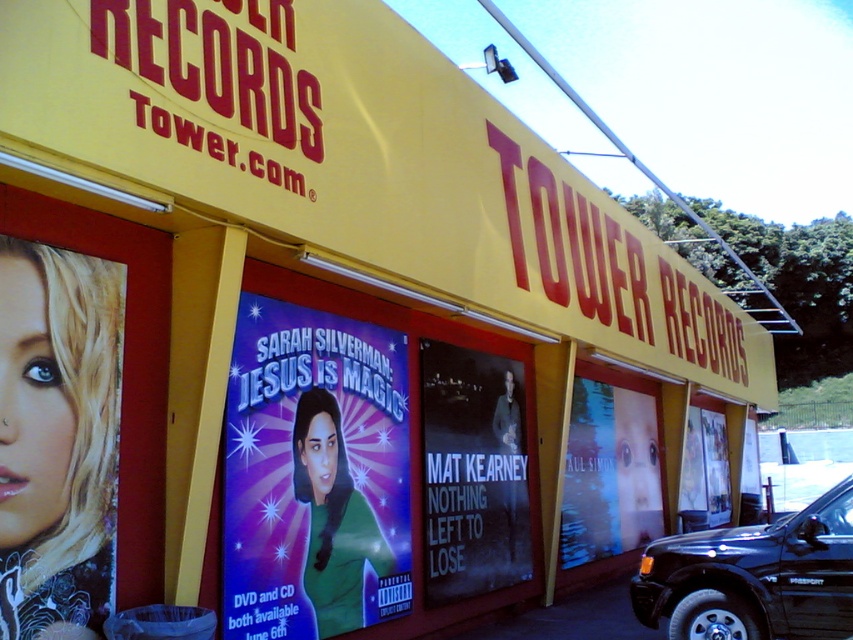
This screenshot has height=640, width=853. What do you see at coordinates (312, 474) in the screenshot? I see `purple glossy poster at center` at bounding box center [312, 474].

Does purple glossy poster at center have a smaller size compared to black matte poster at center?

Yes, purple glossy poster at center is smaller than black matte poster at center.

Which is behind, point (347, 358) or point (444, 477)?

The point (444, 477) is behind.

Find the location of a particular element. The width and height of the screenshot is (853, 640). purple glossy poster at center is located at coordinates (312, 474).

Is blonde hair at left smaller than white glossy poster at center?

Yes, blonde hair at left is smaller than white glossy poster at center.

What do you see at coordinates (57, 438) in the screenshot? I see `blonde hair at left` at bounding box center [57, 438].

Locate an element on the screen. The width and height of the screenshot is (853, 640). blonde hair at left is located at coordinates (57, 438).

Locate an element on the screen. The width and height of the screenshot is (853, 640). blonde hair at left is located at coordinates pyautogui.click(x=57, y=438).

Is black glossy suv at lower right smaller than black matte truck at right?

Yes, black glossy suv at lower right is smaller than black matte truck at right.

Does black glossy suv at lower right have a greater width compared to black matte truck at right?

No, black glossy suv at lower right is not wider than black matte truck at right.

Measure the distance between point [728,596] and camera.

The distance of point [728,596] from camera is 5.83 meters.

Where is `black glossy suv at lower right`? black glossy suv at lower right is located at coordinates (753, 577).